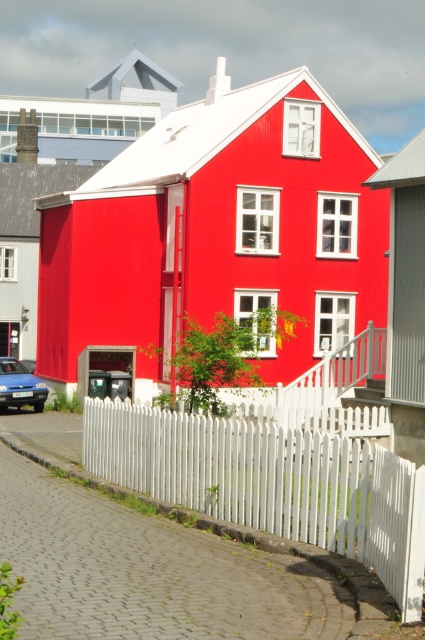
You are standing in front of the house and want to park your matte blue car at lower left. However, the white picket fence at lower center is blocking the way. Can you drive around the fence to park your car?

The white picket fence at lower center is positioned over matte blue car at lower left, meaning the fence is directly above the car. This suggests the car is already parked under the fence, so there is no need to drive around it. However, if you want to park elsewhere, you might need to find another spot not blocked by the fence.